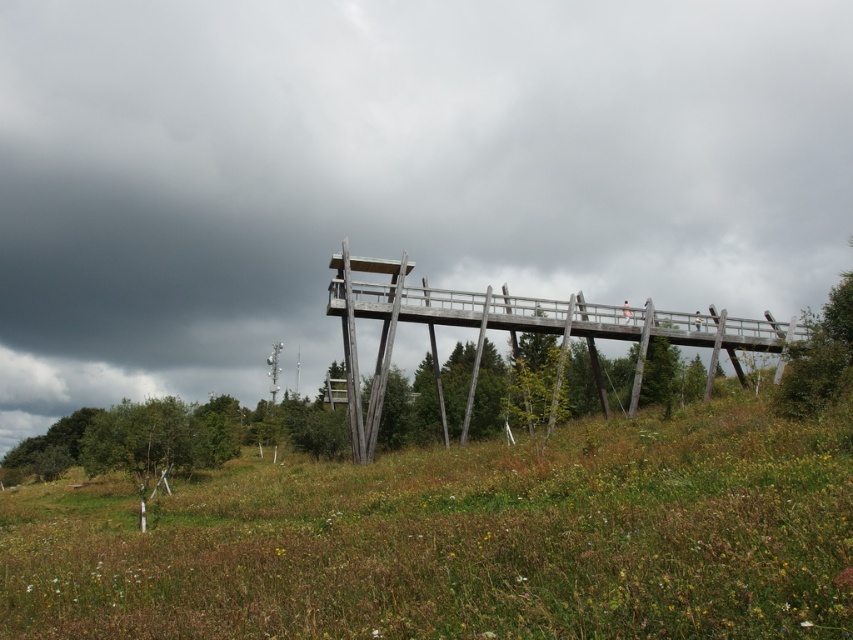
Measure the distance between gray cloudy sky at upper center and camera.

125.65 feet

Based on the photo, is gray cloudy sky at upper center shorter than wooden bridge at center?

No.

What do you see at coordinates (393, 172) in the screenshot? I see `gray cloudy sky at upper center` at bounding box center [393, 172].

The image size is (853, 640). I want to click on gray cloudy sky at upper center, so click(393, 172).

Is gray cloudy sky at upper center positioned in front of pink fabric person at center?

Yes.

What do you see at coordinates (393, 172) in the screenshot?
I see `gray cloudy sky at upper center` at bounding box center [393, 172].

This screenshot has width=853, height=640. Describe the element at coordinates (393, 172) in the screenshot. I see `gray cloudy sky at upper center` at that location.

This screenshot has width=853, height=640. Find the location of `gray cloudy sky at upper center`. gray cloudy sky at upper center is located at coordinates (393, 172).

Who is taller, wooden bridge at center or pink fabric person at center?

Standing taller between the two is wooden bridge at center.

Does wooden bridge at center have a lesser height compared to pink fabric person at center?

No.

You are a GUI agent. You are given a task and a screenshot of the screen. Output one action in this format:
    pyautogui.click(x=<x>, y=<y>)
    Task: Click on the wooden bridge at center
    The width and height of the screenshot is (853, 640).
    Given the screenshot: What is the action you would take?
    pyautogui.click(x=518, y=330)